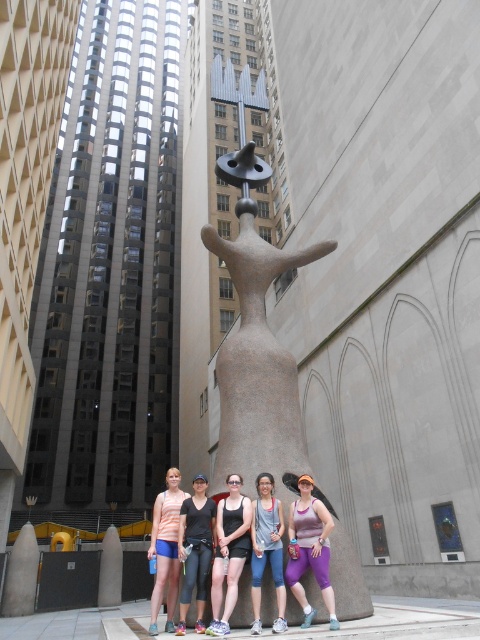
Question: Is purple leggings at center behind gray fabric tank top at center?

Choices:
 (A) yes
 (B) no

Answer: (B)

Question: Which of these objects is positioned farthest from the striped fabric tank top at center?

Choices:
 (A) black leggings at center
 (B) gray fabric tank top at center

Answer: (B)

Question: Can you confirm if brown stone statue at center is positioned to the left of matte black tank top at center?

Choices:
 (A) no
 (B) yes

Answer: (A)

Question: Does purple leggings at center have a greater width compared to gray fabric tank top at center?

Choices:
 (A) yes
 (B) no

Answer: (A)

Question: Which of the following is the closest to the observer?

Choices:
 (A) (240, 557)
 (B) (231, 445)

Answer: (A)

Question: Which object is the farthest from the striped fabric tank top at center?

Choices:
 (A) purple leggings at center
 (B) gray fabric tank top at center
 (C) brown stone statue at center
 (D) black leggings at center

Answer: (C)